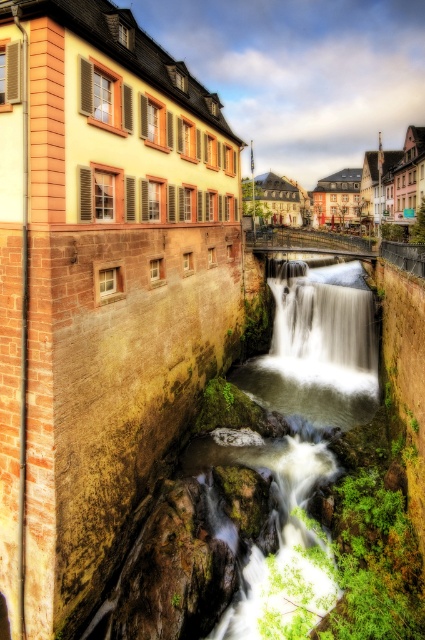
You are a tourist standing on the bridge overlooking the waterway. You notice the pastel painted buildings at center and the white frothy water at center. Which of these two elements is closer to you as you look down from the bridge?

The pastel painted buildings at center are closer to you because the white frothy water at center is positioned behind them.

You are a tourist standing on a bridge overlooking the waterway and the buildings. You want to take a photo that captures both the pastel painted buildings at center and the white frothy water at center. Based on their heights, which one should you focus on first to ensure both are in the frame?

The pastel painted buildings at center are much taller than the white frothy water at center, so you should focus on the pastel painted buildings at center first to ensure both are in the frame.